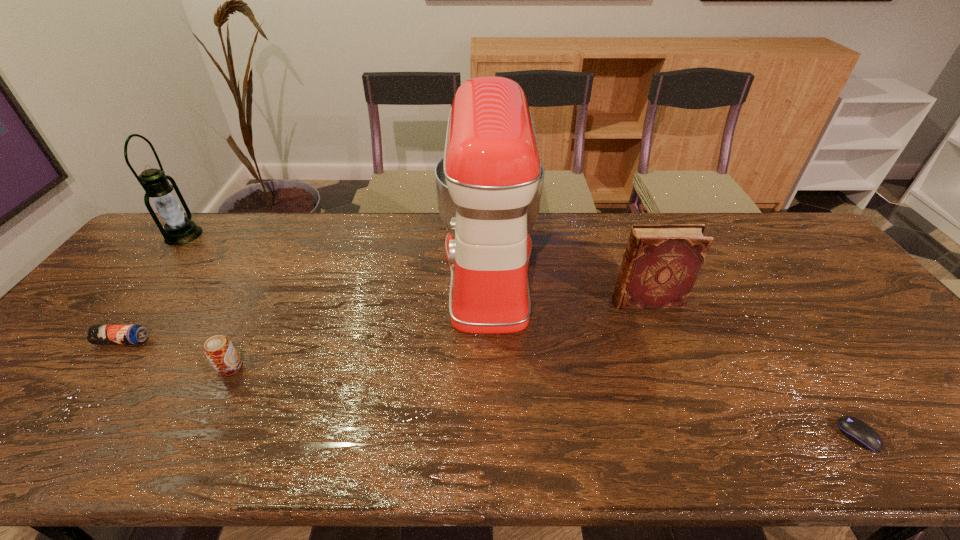
This screenshot has height=540, width=960. In order to click on free area in between the right beer can and the farther beer can in this screenshot , I will do `click(177, 354)`.

This screenshot has height=540, width=960. I want to click on object that stands as the closest to the computer mouse, so click(661, 263).

Where is `the fifth closest object to the left beer can`? the fifth closest object to the left beer can is located at coordinates (856, 430).

Locate an element on the screen. The height and width of the screenshot is (540, 960). vacant space that satisfies the following two spatial constraints: 1. on the side where the nearer beer can emits light; 2. on the left side of the fifth shortest object is located at coordinates (73, 368).

You are a GUI agent. You are given a task and a screenshot of the screen. Output one action in this format:
    pyautogui.click(x=<x>, y=<y>)
    Task: Click on the free spot that satisfies the following two spatial constraints: 1. on the back side of the nearest object; 2. on the spine side of the hardback book
    
    Given the screenshot: What is the action you would take?
    pyautogui.click(x=767, y=301)

This screenshot has height=540, width=960. I want to click on free space that satisfies the following two spatial constraints: 1. on the back side of the nearest object; 2. on the front-facing side of the fourth object from left to right, so click(746, 271).

Where is `vacant space that satisfies the following two spatial constraints: 1. on the side where the shortest object emits light; 2. on the left side of the second tallest object`? This screenshot has width=960, height=540. vacant space that satisfies the following two spatial constraints: 1. on the side where the shortest object emits light; 2. on the left side of the second tallest object is located at coordinates (16, 436).